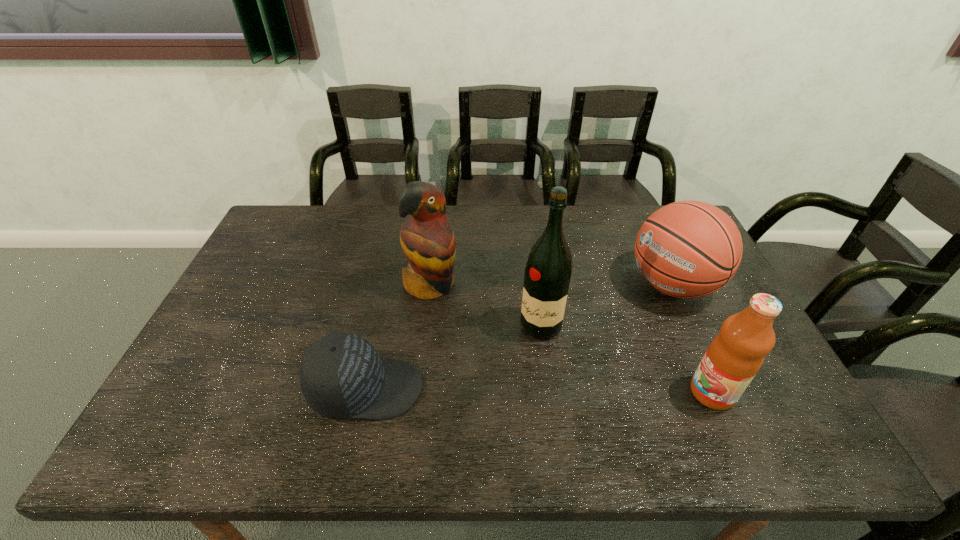
Locate an element on the screen. The height and width of the screenshot is (540, 960). baseball cap is located at coordinates (341, 375).

You are a GUI agent. You are given a task and a screenshot of the screen. Output one action in this format:
    pyautogui.click(x=<x>, y=<y>)
    Task: Click on the fruit juice
    The image size is (960, 540).
    Given the screenshot: What is the action you would take?
    pyautogui.click(x=734, y=357)

Locate an element on the screen. This screenshot has width=960, height=540. liquor is located at coordinates (548, 270).

The height and width of the screenshot is (540, 960). What are the coordinates of `basketball` in the screenshot? It's located at (688, 249).

Where is `parrot`? The image size is (960, 540). parrot is located at coordinates (427, 239).

Image resolution: width=960 pixels, height=540 pixels. In order to click on vacant space situated at the front of the baseball cap where the brim is located in this screenshot , I will do `click(585, 389)`.

This screenshot has width=960, height=540. What are the coordinates of `blank area located on the front label of the fruit juice` in the screenshot? It's located at (605, 393).

You are a GUI agent. You are given a task and a screenshot of the screen. Output one action in this format:
    pyautogui.click(x=<x>, y=<y>)
    Task: Click on the free point located on the front label of the fruit juice
    The height and width of the screenshot is (540, 960).
    Given the screenshot: What is the action you would take?
    pyautogui.click(x=592, y=393)

Identify the location of free space located 0.340m on the front label of the fruit juice. The height and width of the screenshot is (540, 960). (551, 393).

This screenshot has height=540, width=960. Identify the location of free point located 0.110m on the front-facing side of the liquor. (511, 368).